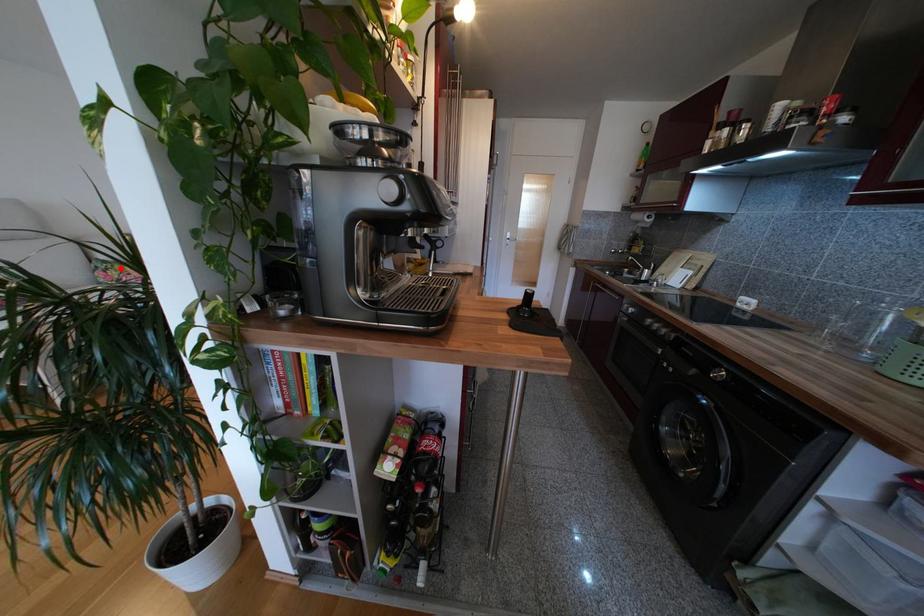
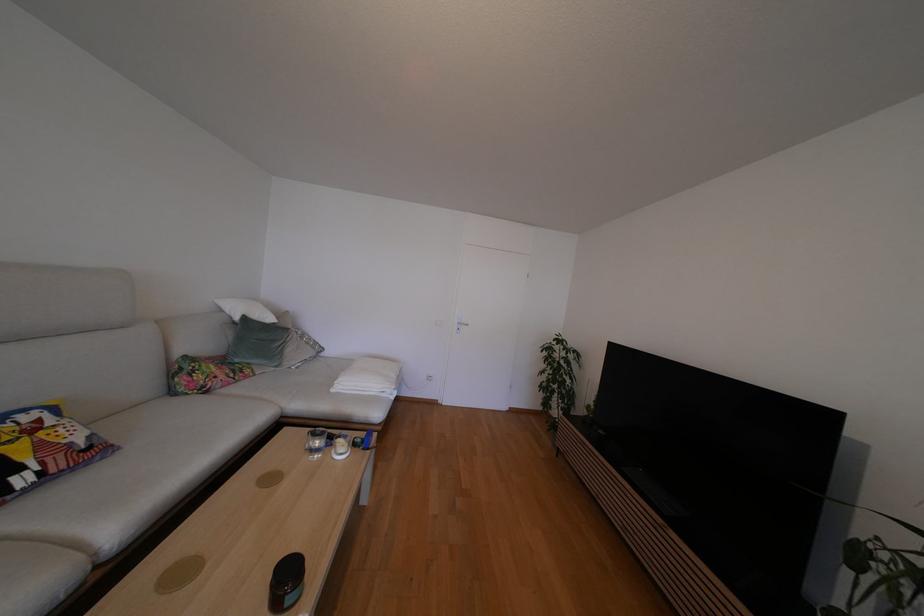
Locate, in the second image, the point that corresponds to the highlighted location in the first image.

(207, 368)